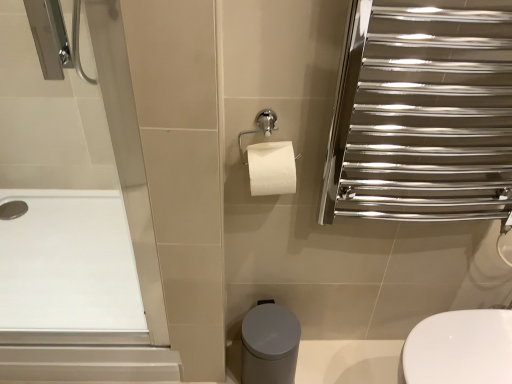
This screenshot has height=384, width=512. Find the location of `white smooth bath at left`. white smooth bath at left is located at coordinates (68, 264).

Where is `white glossy toilet at lower right`? white glossy toilet at lower right is located at coordinates (459, 348).

From the image's perspective, is white smooth bath at left located above or below matte gray bidet at lower center?

white smooth bath at left is above matte gray bidet at lower center.

Considering the positions of objects white smooth bath at left and matte gray bidet at lower center in the image provided, who is in front, white smooth bath at left or matte gray bidet at lower center?

matte gray bidet at lower center is more forward.

Measure the distance between white smooth bath at left and matte gray bidet at lower center.

white smooth bath at left is 25.41 inches from matte gray bidet at lower center.

From the image's perspective, between matte gray bidet at lower center and polished chrome towel rack at upper right, who is located below?

matte gray bidet at lower center, from the image's perspective.

Is matte gray bidet at lower center positioned before polished chrome towel rack at upper right?

No, it is not.

How many degrees apart are the facing directions of matte gray bidet at lower center and polished chrome towel rack at upper right?

The angular difference between matte gray bidet at lower center and polished chrome towel rack at upper right is 0.0523 degrees.

Is matte gray bidet at lower center at the left side of polished chrome towel rack at upper right?

Indeed, matte gray bidet at lower center is positioned on the left side of polished chrome towel rack at upper right.

Is white smooth bath at left completely or partially inside matte gray bidet at lower center?

No, white smooth bath at left is not surrounded by matte gray bidet at lower center.

Between point (283, 373) and point (32, 243), which one is positioned in front?

The point (283, 373) is in front.

Which of these two, matte gray bidet at lower center or white smooth bath at left, is bigger?

white smooth bath at left is bigger.

In terms of height, does matte gray bidet at lower center look taller or shorter compared to white smooth bath at left?

Considering their sizes, matte gray bidet at lower center has more height than white smooth bath at left.

Consider the image. Which object is wider, white glossy toilet at lower right or matte gray bidet at lower center?

With larger width is white glossy toilet at lower right.

In the image, there is a white glossy toilet at lower right. Where is `bidet below it (from the image's perspective)`? bidet below it (from the image's perspective) is located at coordinates (269, 345).

From the image's perspective, between white glossy toilet at lower right and matte gray bidet at lower center, which one is located above?

white glossy toilet at lower right, from the image's perspective.

Considering the positions of point (475, 35) and point (247, 313), is point (475, 35) closer or farther from the camera than point (247, 313)?

Clearly, point (475, 35) is closer to the camera than point (247, 313).

Is polished chrome towel rack at upper right facing away from matte gray bidet at lower center?

polished chrome towel rack at upper right does not have its back to matte gray bidet at lower center.

Considering the relative sizes of polished chrome towel rack at upper right and matte gray bidet at lower center in the image provided, is polished chrome towel rack at upper right wider than matte gray bidet at lower center?

Incorrect, the width of polished chrome towel rack at upper right does not surpass that of matte gray bidet at lower center.

Considering the sizes of objects polished chrome towel rack at upper right and matte gray bidet at lower center in the image provided, who is smaller, polished chrome towel rack at upper right or matte gray bidet at lower center?

matte gray bidet at lower center is smaller.

Can you confirm if white smooth bath at left is taller than white glossy toilet at lower right?

Incorrect, the height of white smooth bath at left is not larger of that of white glossy toilet at lower right.

Which is nearer, [105,217] or [452,354]?

Point [105,217] is positioned farther from the camera compared to point [452,354].

From a real-world perspective, between white smooth bath at left and white glossy toilet at lower right, who is vertically lower?

white smooth bath at left, from a real-world perspective.

Who is smaller, white smooth bath at left or white glossy toilet at lower right?

With smaller size is white smooth bath at left.

Between white glossy toilet at lower right and white smooth bath at left, which one appears on the left side from the viewer's perspective?

Positioned to the left is white smooth bath at left.

In the scene shown: Who is bigger, white glossy toilet at lower right or white smooth bath at left?

white glossy toilet at lower right.

Identify the location of bath that appears above the matte gray bidet at lower center (from the image's perspective). (68, 264).

The width and height of the screenshot is (512, 384). What are the coordinates of `bidet on the left of polished chrome towel rack at upper right` in the screenshot? It's located at (269, 345).

Based on their spatial positions, is white smooth bath at left or polished chrome towel rack at upper right further from white glossy toilet at lower right?

Based on the image, white smooth bath at left appears to be further to white glossy toilet at lower right.

Estimate the real-world distances between objects in this image. Which object is closer to polished chrome towel rack at upper right, white glossy toilet at lower right or matte gray bidet at lower center?

white glossy toilet at lower right is closer to polished chrome towel rack at upper right.

Which object lies further to the anchor point white glossy toilet at lower right, polished chrome towel rack at upper right or white smooth bath at left?

Among the two, white smooth bath at left is located further to white glossy toilet at lower right.

Estimate the real-world distances between objects in this image. Which object is closer to white glossy toilet at lower right, matte gray bidet at lower center or polished chrome towel rack at upper right?

Among the two, matte gray bidet at lower center is located nearer to white glossy toilet at lower right.

Looking at the image, which one is located closer to white smooth bath at left, white glossy toilet at lower right or matte gray bidet at lower center?

The object closer to white smooth bath at left is matte gray bidet at lower center.

Which object lies nearer to the anchor point white smooth bath at left, polished chrome towel rack at upper right or matte gray bidet at lower center?

matte gray bidet at lower center is positioned closer to the anchor white smooth bath at left.

Estimate the real-world distances between objects in this image. Which object is closer to polished chrome towel rack at upper right, matte gray bidet at lower center or white smooth bath at left?

Based on the image, matte gray bidet at lower center appears to be nearer to polished chrome towel rack at upper right.

Considering their positions, is polished chrome towel rack at upper right positioned closer to white glossy toilet at lower right than matte gray bidet at lower center?

matte gray bidet at lower center.

Locate an element on the screen. Image resolution: width=512 pixels, height=384 pixels. screen door between white smooth bath at left and white glossy toilet at lower right in the horizontal direction is located at coordinates tap(423, 113).

Locate an element on the screen. This screenshot has height=384, width=512. toilet between polished chrome towel rack at upper right and matte gray bidet at lower center in the vertical direction is located at coordinates (459, 348).

The height and width of the screenshot is (384, 512). In order to click on bidet between white smooth bath at left and white glossy toilet at lower right in the horizontal direction in this screenshot , I will do `click(269, 345)`.

Where is `bidet situated between white smooth bath at left and polished chrome towel rack at upper right from left to right`? bidet situated between white smooth bath at left and polished chrome towel rack at upper right from left to right is located at coordinates (269, 345).